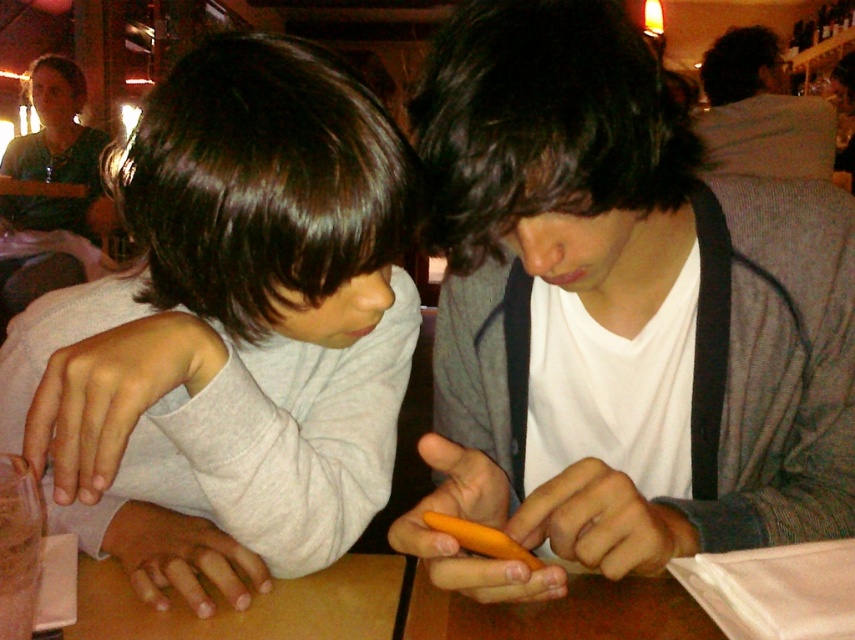
You are taking a photo of two people sitting at a table. You want to focus on the person closer to the camera. Which point, point (382, 129) or point (806, 168), should you adjust your camera focus to?

Point (382, 129) is closer to the camera than point (806, 168), so you should adjust your camera focus to point (382, 129).

You are a customer service representative trying to locate an orange matte phone at center in a crowded restaurant. The manager provided coordinates as point [617,312]. Where should you look to find the orange matte phone at center?

The orange matte phone at center is located at point [617,312], so you should look there to find it.